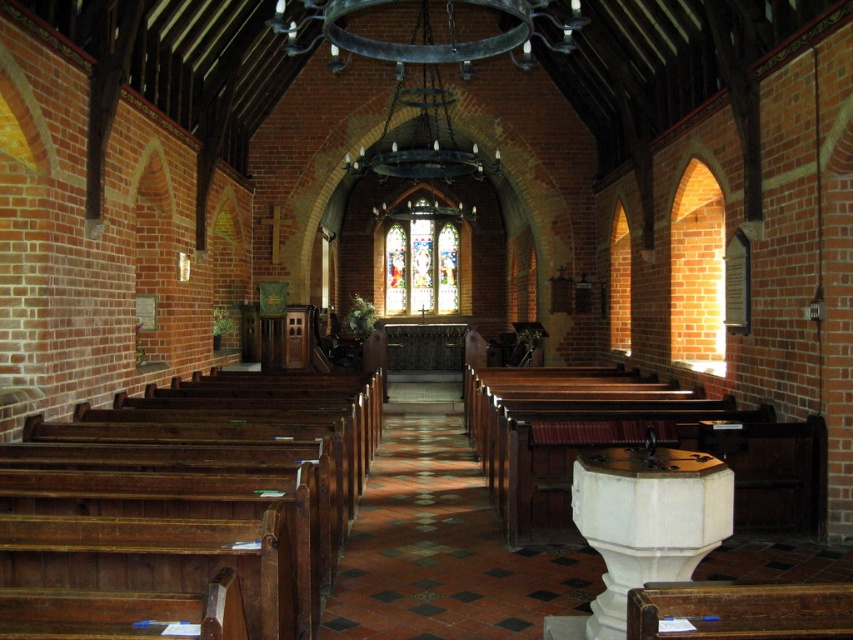
Question: Is dark brown wood pews at left further to the viewer compared to stained glass at center?

Choices:
 (A) yes
 (B) no

Answer: (B)

Question: Is dark brown wood pews at left smaller than stained glass at center?

Choices:
 (A) no
 (B) yes

Answer: (A)

Question: Among these objects, which one is nearest to the camera?

Choices:
 (A) dark brown wood pews at left
 (B) stained glass at center

Answer: (A)

Question: Observing the image, what is the correct spatial positioning of dark brown wood pews at left in reference to stained glass at center?

Choices:
 (A) below
 (B) above

Answer: (A)

Question: Which of the following is the farthest from the observer?

Choices:
 (A) stained glass at center
 (B) dark brown wood pews at left

Answer: (A)